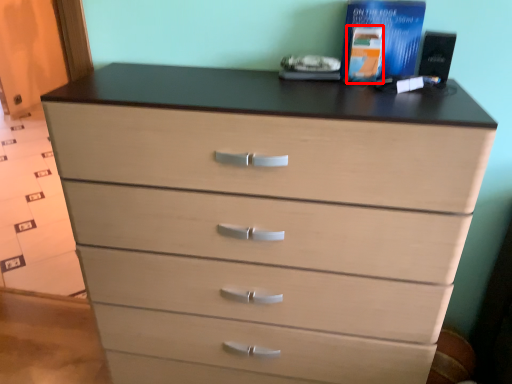
Question: From the image's perspective, considering the relative positions of book (annotated by the red box) and book in the image provided, where is book (annotated by the red box) located with respect to the staircase?

Choices:
 (A) below
 (B) above

Answer: (A)